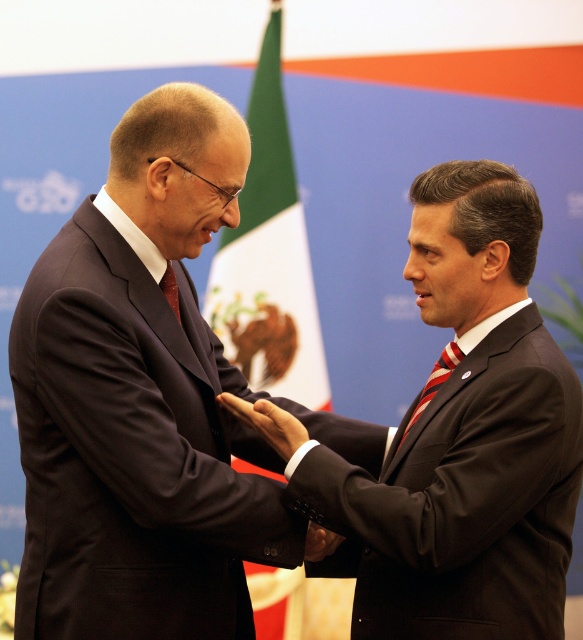
Is point (444, 355) closer to viewer compared to point (166, 282)?

No.

Is striped fabric tie at center above matte red tie at center?

No.

Who is more forward, (444, 348) or (175, 291)?

Point (175, 291) is more forward.

This screenshot has width=583, height=640. I want to click on striped fabric tie at center, so click(433, 381).

Can you confirm if matte black suit at center is positioned below matte red tie at center?

Yes, matte black suit at center is below matte red tie at center.

Is matte black suit at center closer to camera compared to matte red tie at center?

Yes, matte black suit at center is closer to the viewer.

Find the location of a particular element. The height and width of the screenshot is (640, 583). matte black suit at center is located at coordinates (268, 422).

Identify the location of matte black suit at center. The image size is (583, 640). (268, 422).

Is the position of green fabric flag at center more distant than that of matte red tie at center?

→ Yes, green fabric flag at center is further from the viewer.

At what (x,y) coordinates should I click in order to perform the action: click on green fabric flag at center. Please return your answer as a coordinate pair (x, y). Looking at the image, I should click on (268, 257).